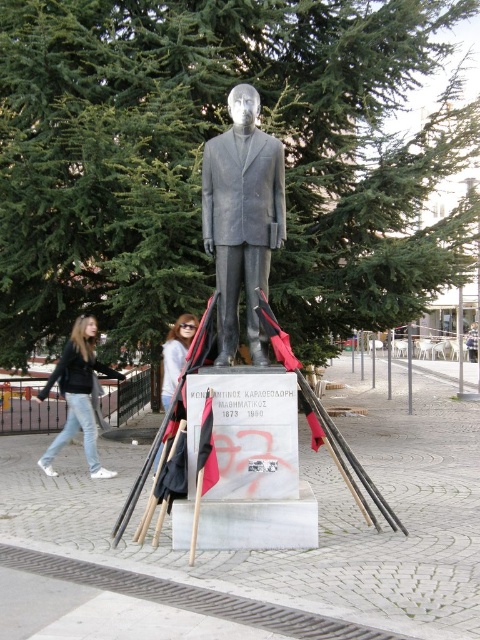
Question: Among these objects, which one is nearest to the camera?

Choices:
 (A) bronze statue at center
 (B) jeans at lower left

Answer: (A)

Question: Does bronze statue at center have a lesser width compared to jeans at lower left?

Choices:
 (A) no
 (B) yes

Answer: (B)

Question: Does bronze statue at center lie in front of jeans at lower left?

Choices:
 (A) yes
 (B) no

Answer: (A)

Question: Can you confirm if bronze statue at center is wider than jeans at lower left?

Choices:
 (A) yes
 (B) no

Answer: (B)